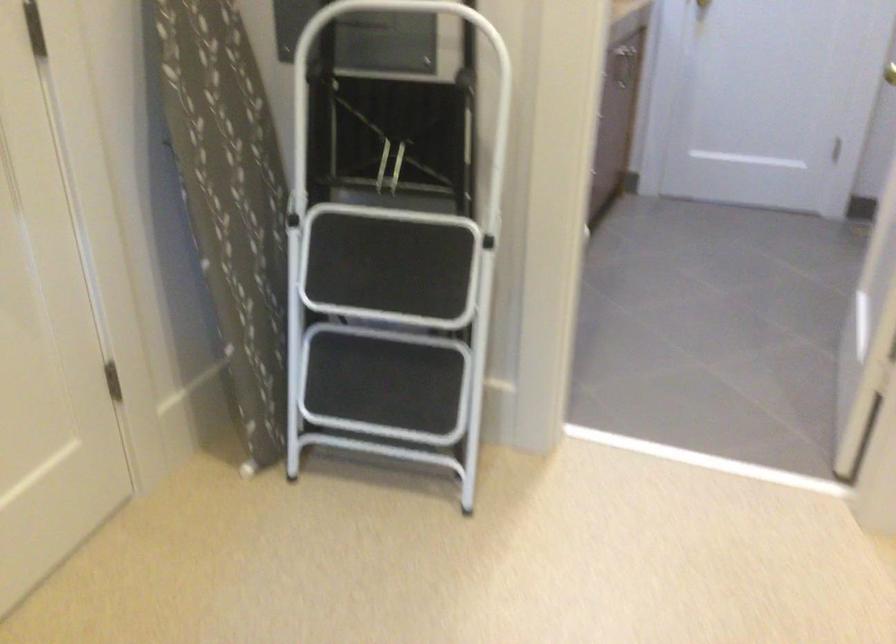
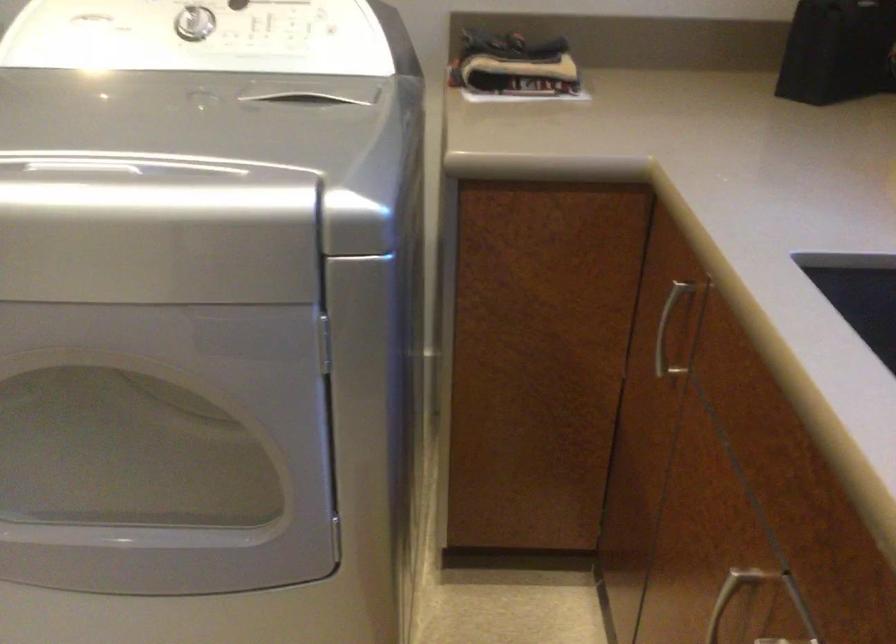
First-person continuous shooting, in which direction is the camera rotating?

The camera's rotation is toward right-down.